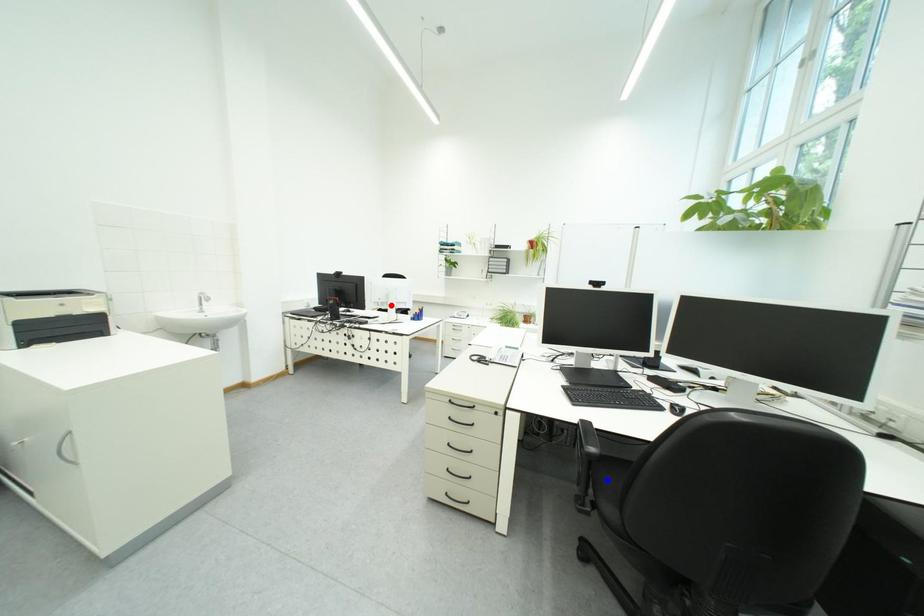
Question: In the image, two points are highlighted. Which point is nearer to the camera? Reply with the corresponding letter.

Choices:
 (A) blue point
 (B) red point

Answer: (A)